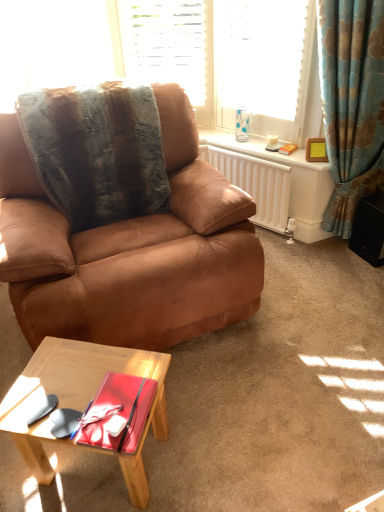
Identify the location of wooden picture frame at upper right. pyautogui.click(x=316, y=150).

The height and width of the screenshot is (512, 384). I want to click on glassy blue curtain at upper right, which appears as the second window when viewed from the left, so click(x=258, y=57).

The width and height of the screenshot is (384, 512). What do you see at coordinates (352, 103) in the screenshot? I see `blue floral fabric curtain at right` at bounding box center [352, 103].

The width and height of the screenshot is (384, 512). I want to click on white textured blinds at upper center, which is the second window from right to left, so click(x=165, y=42).

Measure the distance between point (275,134) and camera.

The depth of point (275,134) is 8.52 feet.

What is the approximate height of fuzzy brown blanket at upper left?

fuzzy brown blanket at upper left is 60.26 centimeters tall.

Image resolution: width=384 pixels, height=512 pixels. Find the location of `wooden picture frame at upper right`. wooden picture frame at upper right is located at coordinates (316, 150).

Considering the relative sizes of fuzzy brown blanket at upper left and light wood coffee table at lower left in the image provided, is fuzzy brown blanket at upper left thinner than light wood coffee table at lower left?

Yes.

From the image's perspective, would you say fuzzy brown blanket at upper left is shown under light wood coffee table at lower left?

No.

From a real-world perspective, is fuzzy brown blanket at upper left above or below light wood coffee table at lower left?

fuzzy brown blanket at upper left is above light wood coffee table at lower left.

Choose the correct answer: Is white textured blinds at upper center, acting as the 1th window starting from the left, inside wooden picture frame at upper right or outside it?

white textured blinds at upper center, acting as the 1th window starting from the left, is not enclosed by wooden picture frame at upper right.

From the image's perspective, does white textured blinds at upper center, acting as the 1th window starting from the left, appear higher than wooden picture frame at upper right?

Yes, from the image's perspective, white textured blinds at upper center, acting as the 1th window starting from the left, is on top of wooden picture frame at upper right.

Is white textured blinds at upper center, acting as the 1th window starting from the left, thinner than wooden picture frame at upper right?

In fact, white textured blinds at upper center, acting as the 1th window starting from the left, might be wider than wooden picture frame at upper right.

From the image's perspective, does light wood coffee table at lower left appear higher than glassy blue curtain at upper right, which appears as the second window when viewed from the left?

No.

Between light wood coffee table at lower left and glassy blue curtain at upper right, which appears as the second window when viewed from the left, which one is positioned behind?

glassy blue curtain at upper right, which appears as the second window when viewed from the left, is more distant.

Is light wood coffee table at lower left positioned far away from glassy blue curtain at upper right, the first window positioned from the right?

Absolutely, light wood coffee table at lower left is distant from glassy blue curtain at upper right, the first window positioned from the right.

Looking at this image, is glassy blue curtain at upper right, the first window positioned from the right, positioned with its back to translucent glass coffee cup at upper right?

glassy blue curtain at upper right, the first window positioned from the right, is not turned away from translucent glass coffee cup at upper right.

Can you confirm if glassy blue curtain at upper right, which appears as the second window when viewed from the left, is wider than translucent glass coffee cup at upper right?

Yes.

From the image's perspective, which is above, glassy blue curtain at upper right, which appears as the second window when viewed from the left, or translucent glass coffee cup at upper right?

From the image's view, glassy blue curtain at upper right, which appears as the second window when viewed from the left, is above.

Relative to translucent glass coffee cup at upper right, is glassy blue curtain at upper right, the first window positioned from the right, in front or behind?

Visually, glassy blue curtain at upper right, the first window positioned from the right, is located in front of translucent glass coffee cup at upper right.

In terms of width, does wooden picture frame at upper right look wider or thinner when compared to translucent glass coffee cup at upper right?

Clearly, wooden picture frame at upper right has less width compared to translucent glass coffee cup at upper right.

You are a GUI agent. You are given a task and a screenshot of the screen. Output one action in this format:
    pyautogui.click(x=<x>, y=<y>)
    Task: Click on the coffee cup behind the wooden picture frame at upper right
    The width and height of the screenshot is (384, 512).
    Given the screenshot: What is the action you would take?
    pyautogui.click(x=272, y=142)

From the image's perspective, which one is positioned higher, wooden picture frame at upper right or translucent glass coffee cup at upper right?

translucent glass coffee cup at upper right appears higher in the image.

Is the position of wooden picture frame at upper right more distant than that of translucent glass coffee cup at upper right?

No, the depth of wooden picture frame at upper right is less than that of translucent glass coffee cup at upper right.

From the picture: Are blue floral fabric curtain at right and white matte radiator at upper right far apart?

No, blue floral fabric curtain at right is not far from white matte radiator at upper right.

What's the angular difference between blue floral fabric curtain at right and white matte radiator at upper right's facing directions?

60.2 degrees separate the facing orientations of blue floral fabric curtain at right and white matte radiator at upper right.

From the image's perspective, is blue floral fabric curtain at right below white matte radiator at upper right?

No, from the image's perspective, blue floral fabric curtain at right is not beneath white matte radiator at upper right.

Considering the sizes of objects blue floral fabric curtain at right and white matte radiator at upper right in the image provided, who is smaller, blue floral fabric curtain at right or white matte radiator at upper right?

white matte radiator at upper right is smaller.

The image size is (384, 512). I want to click on curtain located above the white matte radiator at upper right (from the image's perspective), so [x=352, y=103].

Considering the sizes of objects white matte radiator at upper right and blue floral fabric curtain at right in the image provided, who is shorter, white matte radiator at upper right or blue floral fabric curtain at right?

With less height is white matte radiator at upper right.

Does white matte radiator at upper right have a lesser width compared to blue floral fabric curtain at right?

Indeed, white matte radiator at upper right has a lesser width compared to blue floral fabric curtain at right.

Would you say white matte radiator at upper right contains blue floral fabric curtain at right?

That's incorrect, blue floral fabric curtain at right is not inside white matte radiator at upper right.

Identify the location of coffee table located in front of the fuzzy brown blanket at upper left. (81, 401).

I want to click on the 2nd window positioned above the wooden picture frame at upper right (from the image's perspective), so click(x=165, y=42).

From the image, which object appears to be nearer to white matte radiator at upper right, fuzzy brown blanket at upper left or light wood coffee table at lower left?

fuzzy brown blanket at upper left.

From the image, which object appears to be farther from wooden picture frame at upper right, white matte radiator at upper right or translucent glass coffee cup at upper right?

white matte radiator at upper right is positioned further to the anchor wooden picture frame at upper right.

Looking at the image, which one is located closer to blue floral fabric curtain at right, light wood coffee table at lower left or fuzzy brown blanket at upper left?

fuzzy brown blanket at upper left lies closer to blue floral fabric curtain at right than the other object.

Based on their spatial positions, is blue floral fabric curtain at right or white matte radiator at upper right further from glassy blue curtain at upper right, which appears as the second window when viewed from the left?

Based on the image, white matte radiator at upper right appears to be further to glassy blue curtain at upper right, which appears as the second window when viewed from the left.

Considering their positions, is white matte radiator at upper right positioned further to white textured blinds at upper center, acting as the 1th window starting from the left, than wooden picture frame at upper right?

Among the two, wooden picture frame at upper right is located further to white textured blinds at upper center, acting as the 1th window starting from the left.

Considering their positions, is white matte radiator at upper right positioned further to brown leather chair at center than fuzzy brown blanket at upper left?

Based on the image, white matte radiator at upper right appears to be further to brown leather chair at center.

From the image, which object appears to be nearer to light wood coffee table at lower left, white matte radiator at upper right or blue floral fabric curtain at right?

white matte radiator at upper right lies closer to light wood coffee table at lower left than the other object.

Estimate the real-world distances between objects in this image. Which object is further from blue floral fabric curtain at right, brown leather chair at center or fuzzy brown blanket at upper left?

fuzzy brown blanket at upper left is positioned further to the anchor blue floral fabric curtain at right.

This screenshot has width=384, height=512. I want to click on window between white textured blinds at upper center, which is the second window from right to left, and blue floral fabric curtain at right from left to right, so click(x=258, y=57).

You are a GUI agent. You are given a task and a screenshot of the screen. Output one action in this format:
    pyautogui.click(x=<x>, y=<y>)
    Task: Click on the coffee table between brown leather chair at center and translucent glass coffee cup at upper right from front to back
    
    Given the screenshot: What is the action you would take?
    pyautogui.click(x=81, y=401)

Image resolution: width=384 pixels, height=512 pixels. I want to click on radiator between glassy blue curtain at upper right, which appears as the second window when viewed from the left, and light wood coffee table at lower left vertically, so click(x=255, y=183).

The height and width of the screenshot is (512, 384). In order to click on curtain that lies between glassy blue curtain at upper right, which appears as the second window when viewed from the left, and white matte radiator at upper right from top to bottom in this screenshot , I will do `click(352, 103)`.